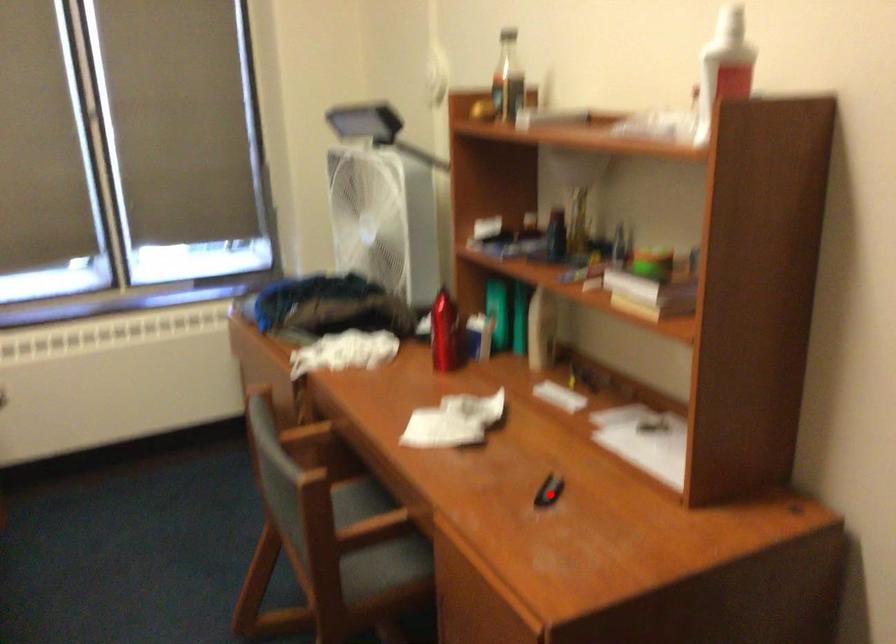
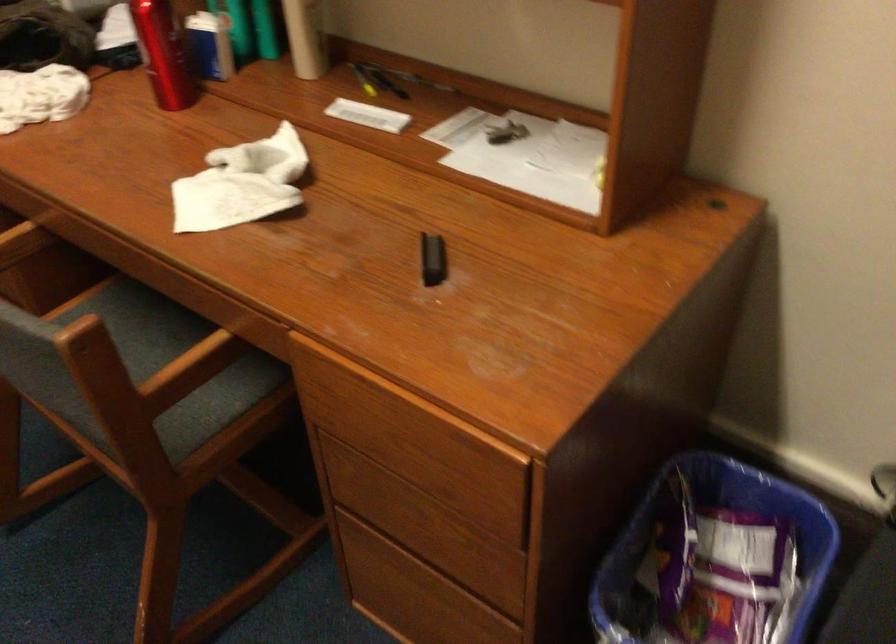
Question: I am providing you with two images of the same scene from different viewpoints. Given a red point in image1, look at the same physical point in image2. Is it:

Choices:
 (A) Closer to the viewpoint
 (B) Farther from the viewpoint

Answer: (A)